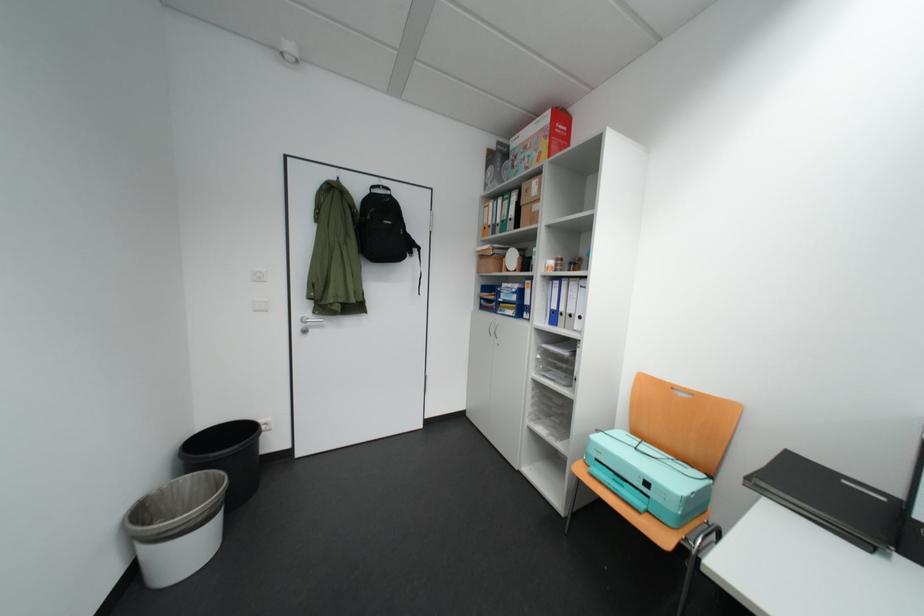
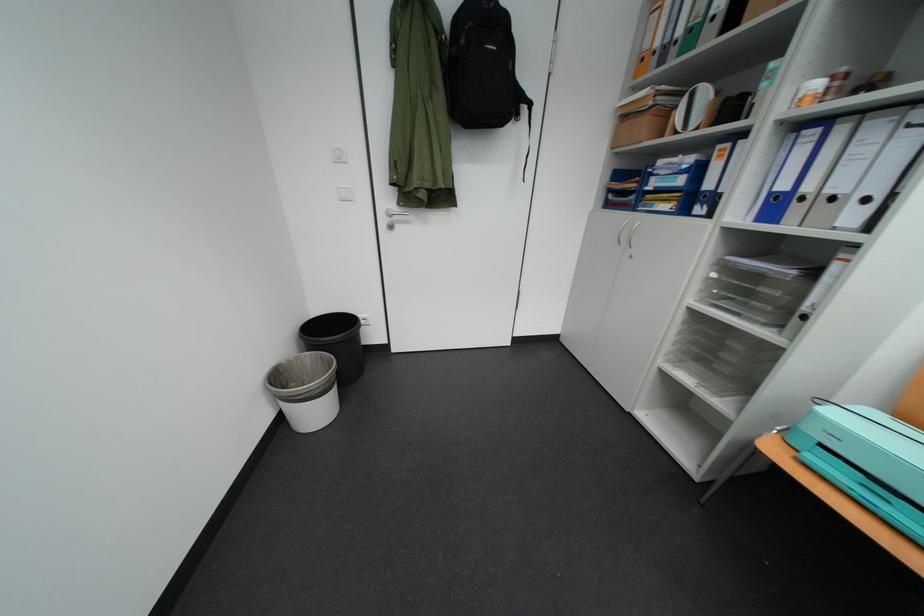
How did the camera likely rotate?

The camera rotated toward left-down.